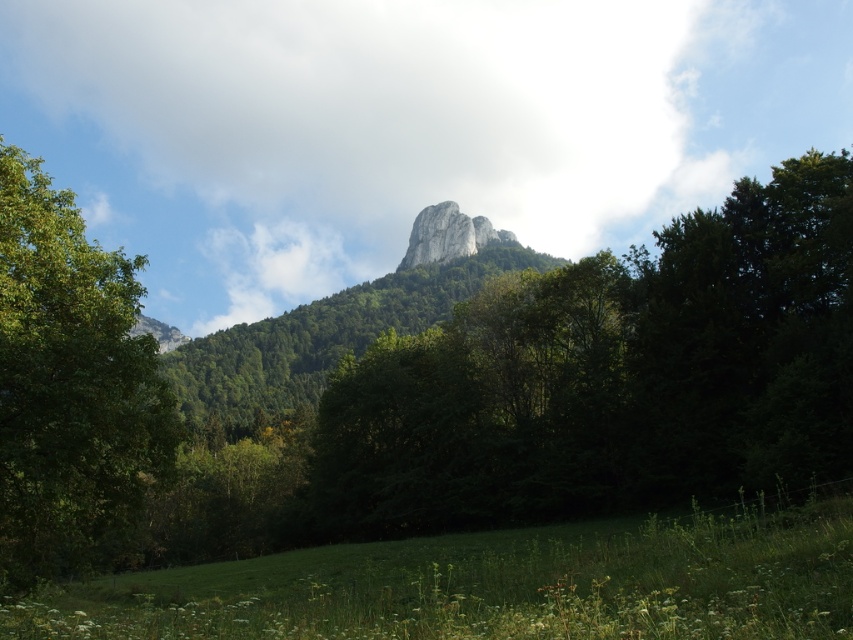
Is green leafy tree at center smaller than green grass at lower center?

Incorrect, green leafy tree at center is not smaller in size than green grass at lower center.

Is the position of green leafy tree at center more distant than that of green grass at lower center?

That is True.

What are the coordinates of `green leafy tree at center` in the screenshot? It's located at (610, 378).

The width and height of the screenshot is (853, 640). What do you see at coordinates (68, 384) in the screenshot? I see `green leafy tree at left` at bounding box center [68, 384].

Where is `green leafy tree at left`? green leafy tree at left is located at coordinates (68, 384).

Is green grass at lower center to the right of white rock formation at center from the viewer's perspective?

No, green grass at lower center is not to the right of white rock formation at center.

Where is `green grass at lower center`? green grass at lower center is located at coordinates (496, 584).

Describe the element at coordinates (496, 584) in the screenshot. I see `green grass at lower center` at that location.

This screenshot has width=853, height=640. What are the coordinates of `green grass at lower center` in the screenshot? It's located at (496, 584).